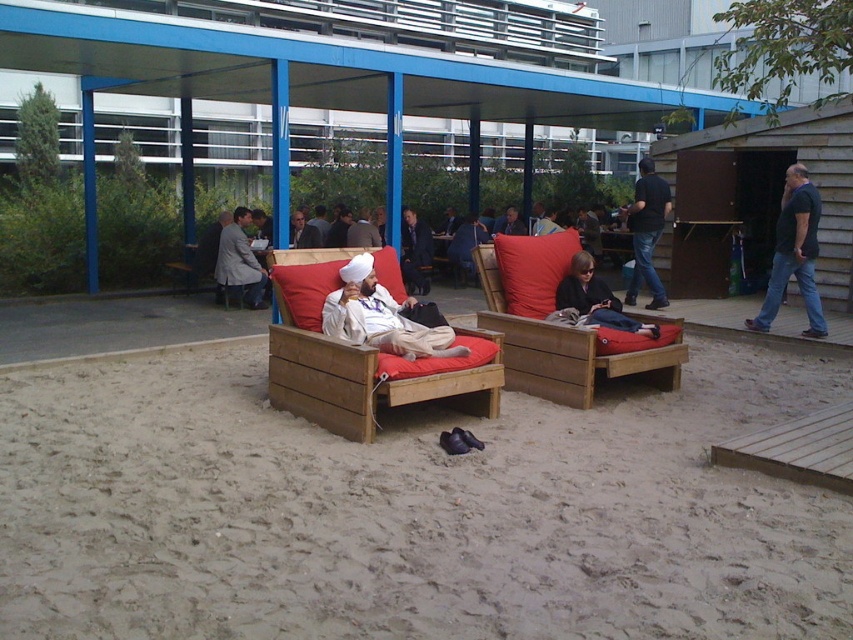
Which is more to the right, blue metal shelter at center or dark blue shirt at right?

dark blue shirt at right

Which is below, blue metal shelter at center or dark blue shirt at right?

dark blue shirt at right

Identify the location of blue metal shelter at center. Image resolution: width=853 pixels, height=640 pixels. (328, 83).

Can you confirm if sandy beige sand at center is positioned to the left of dark blue shirt at right?

Correct, you'll find sandy beige sand at center to the left of dark blue shirt at right.

Who is taller, sandy beige sand at center or dark blue shirt at right?

dark blue shirt at right is taller.

Is point (413, 614) more distant than point (788, 257)?

No, it is not.

You are a GUI agent. You are given a task and a screenshot of the screen. Output one action in this format:
    pyautogui.click(x=<x>, y=<y>)
    Task: Click on the sandy beige sand at center
    Image resolution: width=853 pixels, height=640 pixels.
    Given the screenshot: What is the action you would take?
    pyautogui.click(x=410, y=513)

In the scene shown: Who is positioned more to the right, wooden cushioned couch at center or matte black jacket at center?

From the viewer's perspective, matte black jacket at center appears more on the right side.

Does point (537, 252) come farther from viewer compared to point (577, 301)?

Yes, it is behind point (577, 301).

You are a GUI agent. You are given a task and a screenshot of the screen. Output one action in this format:
    pyautogui.click(x=<x>, y=<y>)
    Task: Click on the wooden cushioned couch at center
    The width and height of the screenshot is (853, 640).
    Given the screenshot: What is the action you would take?
    pyautogui.click(x=561, y=326)